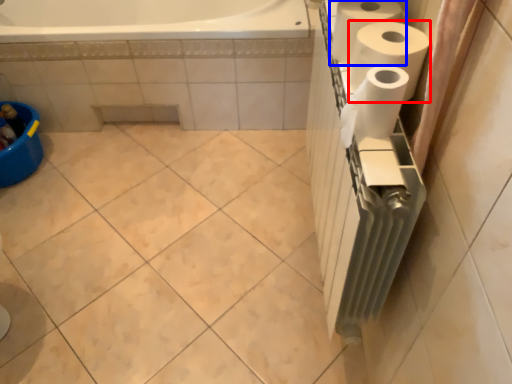
Question: Which point is closer to the camera, paper towel (highlighted by a red box) or paper towel (highlighted by a blue box)?

Choices:
 (A) paper towel
 (B) paper towel

Answer: (A)